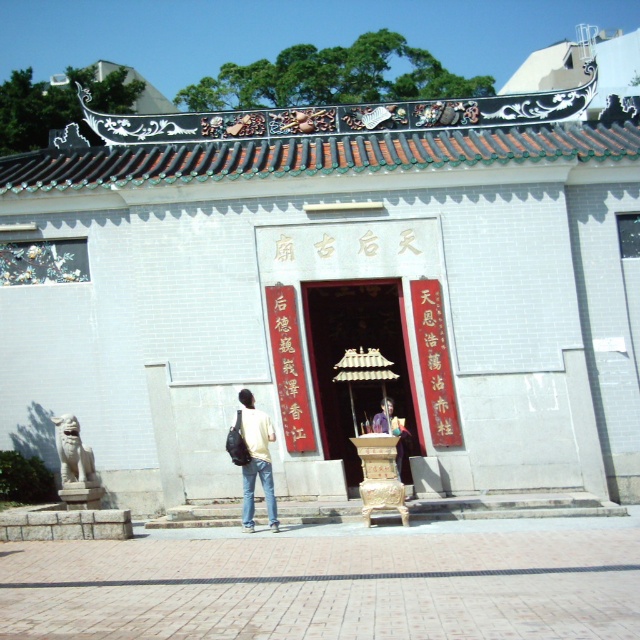
Can you confirm if light yellow t-shirt at center is positioned to the left of dark blue shirt at center?

Indeed, light yellow t-shirt at center is positioned on the left side of dark blue shirt at center.

At what (x,y) coordinates should I click in order to perform the action: click on light yellow t-shirt at center. Please return your answer as a coordinate pair (x, y). The width and height of the screenshot is (640, 640). Looking at the image, I should click on (256, 460).

Which is above, smooth wooden altar at center or dark blue shirt at center?

Positioned higher is smooth wooden altar at center.

Can you confirm if smooth wooden altar at center is thinner than dark blue shirt at center?

In fact, smooth wooden altar at center might be wider than dark blue shirt at center.

Locate an element on the screen. smooth wooden altar at center is located at coordinates (356, 348).

Does smooth wooden altar at center have a greater height compared to light yellow t-shirt at center?

Indeed, smooth wooden altar at center has a greater height compared to light yellow t-shirt at center.

Does smooth wooden altar at center lie behind light yellow t-shirt at center?

Yes, smooth wooden altar at center is further from the viewer.

Does point (358, 474) come in front of point (264, 428)?

No.

Locate an element on the screen. smooth wooden altar at center is located at coordinates (356, 348).